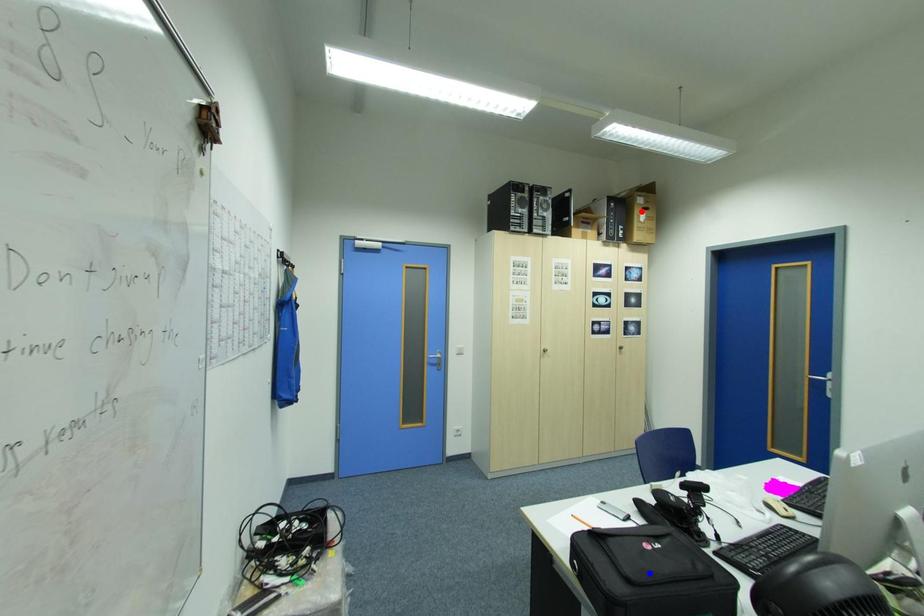
Question: Two points are marked on the image. Which point is closer to the camera?

Choices:
 (A) Blue point is closer.
 (B) Red point is closer.

Answer: (A)